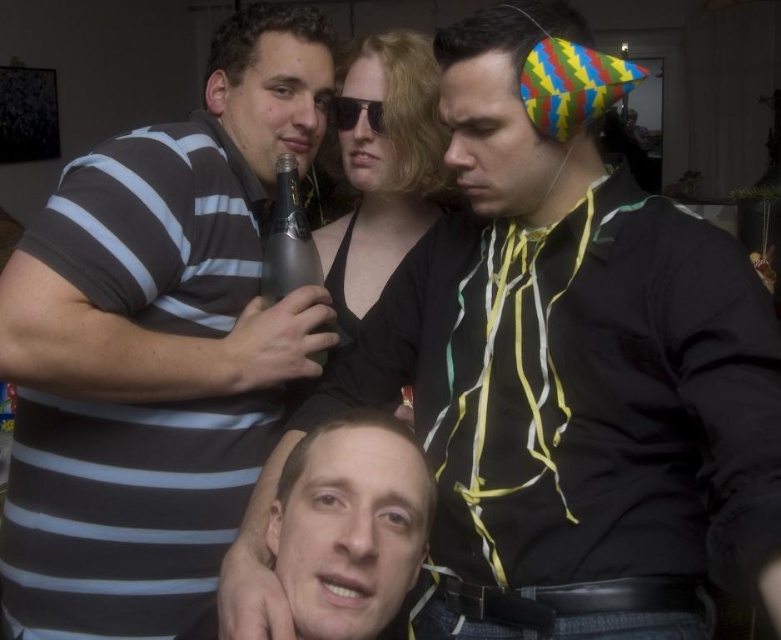
You are a photographer trying to capture a clear portrait of the two men in the middle ground. Since the black plastic sunglasses at center are covering part of the smooth skin face at center, which object should you adjust to ensure the face is fully visible?

The smooth skin face at center is larger in size than the black plastic sunglasses at center. To ensure the face is fully visible, you should adjust the black plastic sunglasses at center to move them away from the face or remove them entirely.